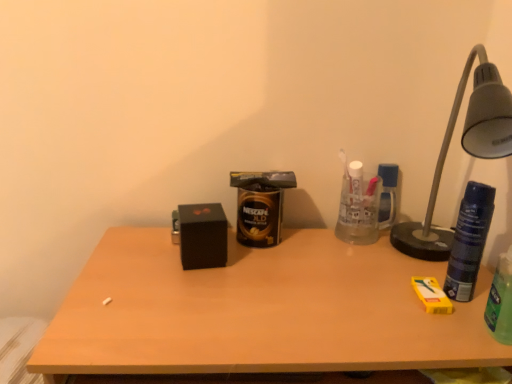
Where is `free region on the left part of blue textured can at right, the 2th beverage in the right-to-left sequence`? The width and height of the screenshot is (512, 384). free region on the left part of blue textured can at right, the 2th beverage in the right-to-left sequence is located at coordinates (364, 291).